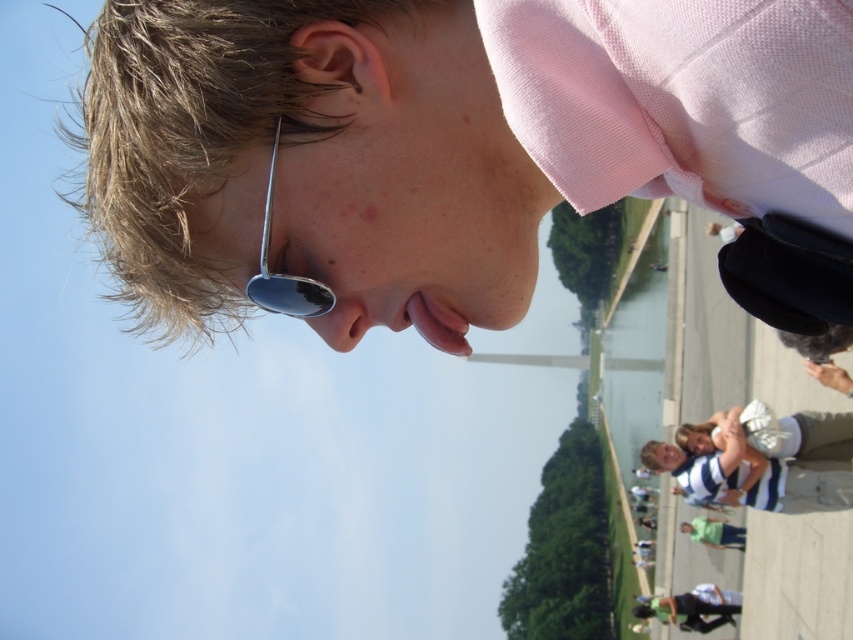
Question: Which object appears closest to the camera in this image?

Choices:
 (A) metallic reflective sunglasses at center
 (B) pink cotton shirt at upper center

Answer: (B)

Question: From the image, what is the correct spatial relationship of pink cotton shirt at upper center in relation to metallic reflective sunglasses at center?

Choices:
 (A) right
 (B) left

Answer: (A)

Question: Is pink cotton shirt at upper center wider than metallic reflective sunglasses at center?

Choices:
 (A) yes
 (B) no

Answer: (A)

Question: Which point appears closest to the camera in this image?

Choices:
 (A) (231, 292)
 (B) (267, 227)

Answer: (B)

Question: Can you confirm if pink cotton shirt at upper center is thinner than metallic reflective sunglasses at center?

Choices:
 (A) no
 (B) yes

Answer: (A)